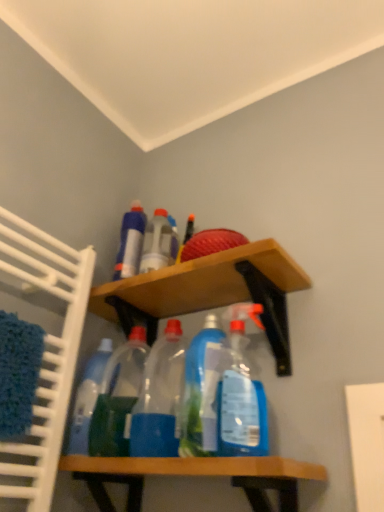
Question: From a real-world perspective, is wooden shelf at upper center, which ranks as the second shelf in bottom-to-top order, located beneath blue plastic bottle at upper center, the first bottle viewed from the left?

Choices:
 (A) no
 (B) yes

Answer: (B)

Question: Could blue plastic bottle at upper center, the first bottle viewed from the left, be considered to be inside wooden shelf at upper center, which is counted as the first shelf, starting from the top?

Choices:
 (A) yes
 (B) no

Answer: (B)

Question: Can you confirm if wooden shelf at upper center, which ranks as the second shelf in bottom-to-top order, is positioned to the left of blue plastic bottle at upper center, the first bottle viewed from the left?

Choices:
 (A) no
 (B) yes

Answer: (A)

Question: From the image's perspective, is wooden shelf at upper center, which ranks as the second shelf in bottom-to-top order, on top of blue plastic bottle at upper center, marked as the 6th bottle in a right-to-left arrangement?

Choices:
 (A) no
 (B) yes

Answer: (A)

Question: Does wooden shelf at upper center, which ranks as the second shelf in bottom-to-top order, have a smaller size compared to blue plastic bottle at upper center, the first bottle viewed from the left?

Choices:
 (A) no
 (B) yes

Answer: (A)

Question: Looking at their shapes, would you say wooden shelf at upper center, which ranks as the second shelf in bottom-to-top order, is wider or thinner than wooden shelf at lower center, the second shelf when ordered from top to bottom?

Choices:
 (A) wide
 (B) thin

Answer: (A)

Question: From a real-world perspective, is wooden shelf at upper center, which ranks as the second shelf in bottom-to-top order, positioned above or below wooden shelf at lower center, the second shelf when ordered from top to bottom?

Choices:
 (A) below
 (B) above

Answer: (B)

Question: Is wooden shelf at upper center, which ranks as the second shelf in bottom-to-top order, to the left or to the right of wooden shelf at lower center, the first shelf from the bottom, in the image?

Choices:
 (A) left
 (B) right

Answer: (B)

Question: Considering the positions of point (251, 273) and point (62, 470), is point (251, 273) closer or farther from the camera than point (62, 470)?

Choices:
 (A) closer
 (B) farther

Answer: (B)

Question: Based on their sizes in the image, would you say transparent plastic bottles at center, the 3th bottle in the right-to-left sequence, is bigger or smaller than wooden shelf at upper center, which is counted as the first shelf, starting from the top?

Choices:
 (A) big
 (B) small

Answer: (B)

Question: From the image's perspective, is transparent plastic bottles at center, the 3th bottle in the right-to-left sequence, above or below wooden shelf at upper center, which is counted as the first shelf, starting from the top?

Choices:
 (A) above
 (B) below

Answer: (B)

Question: Based on their positions, is transparent plastic bottles at center, the fourth bottle positioned from the left, located to the left or right of wooden shelf at upper center, which is counted as the first shelf, starting from the top?

Choices:
 (A) left
 (B) right

Answer: (A)

Question: From a real-world perspective, is transparent plastic bottles at center, the 3th bottle in the right-to-left sequence, physically located above or below wooden shelf at upper center, which is counted as the first shelf, starting from the top?

Choices:
 (A) below
 (B) above

Answer: (A)

Question: From a real-world perspective, is blue plastic bottle at upper center, the first bottle viewed from the left, positioned above or below wooden shelf at upper center, which is counted as the first shelf, starting from the top?

Choices:
 (A) below
 (B) above

Answer: (B)

Question: Considering their positions, is blue plastic bottle at upper center, the first bottle viewed from the left, located in front of or behind wooden shelf at upper center, which ranks as the second shelf in bottom-to-top order?

Choices:
 (A) behind
 (B) front

Answer: (A)